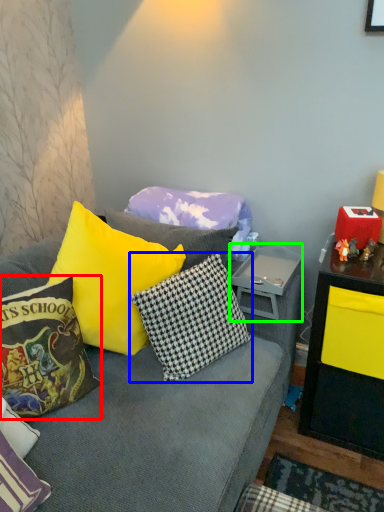
Question: Estimate the real-world distances between objects in this image. Which object is farther from pillow (highlighted by a red box), pillow (highlighted by a blue box) or side table (highlighted by a green box)?

Choices:
 (A) pillow
 (B) side table

Answer: (B)